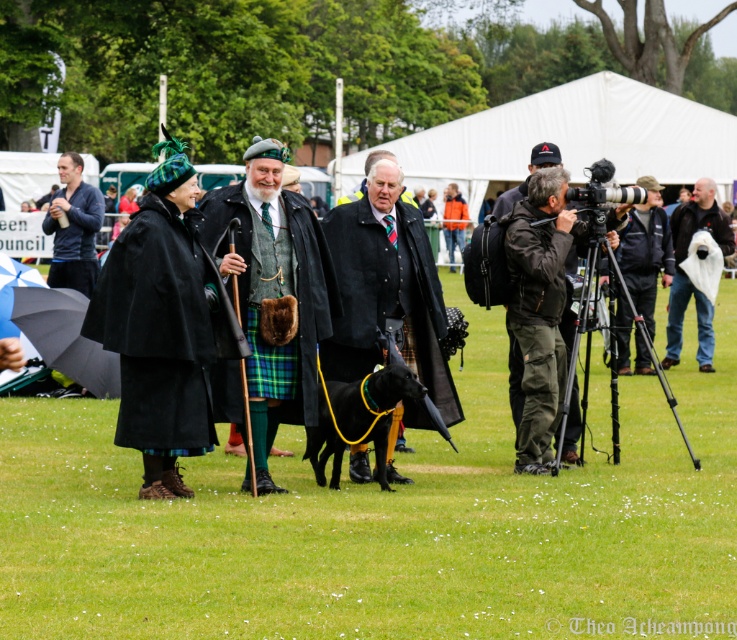
Which is behind, point (349, 180) or point (702, 356)?

Point (349, 180)

Does white fabric tent at upper center have a greater height compared to white fabric bag at right?

Correct, white fabric tent at upper center is much taller as white fabric bag at right.

Is point (632, 144) in front of point (699, 209)?

No, it is behind (699, 209).

Locate an element on the screen. white fabric tent at upper center is located at coordinates (567, 140).

Which is more to the right, green woolen kilt at center or matte black camera at right?

From the viewer's perspective, matte black camera at right appears more on the right side.

Is green woolen kilt at center thinner than matte black camera at right?

No.

Is point (209, 227) positioned before point (640, 289)?

Yes, point (209, 227) is in front of point (640, 289).

You are a GUI agent. You are given a task and a screenshot of the screen. Output one action in this format:
    pyautogui.click(x=<x>, y=<y>)
    Task: Click on the green woolen kilt at center
    Image resolution: width=737 pixels, height=640 pixels.
    Given the screenshot: What is the action you would take?
    pyautogui.click(x=273, y=289)

Is white fabric tent at upper center thinner than green woolen kilt at center?

Incorrect, white fabric tent at upper center's width is not less than green woolen kilt at center's.

Which is more to the right, white fabric tent at upper center or green woolen kilt at center?

Answer: From the viewer's perspective, white fabric tent at upper center appears more on the right side.

Is point (668, 99) in front of point (293, 211)?

No.

The height and width of the screenshot is (640, 737). What are the coordinates of `white fabric tent at upper center` in the screenshot? It's located at (567, 140).